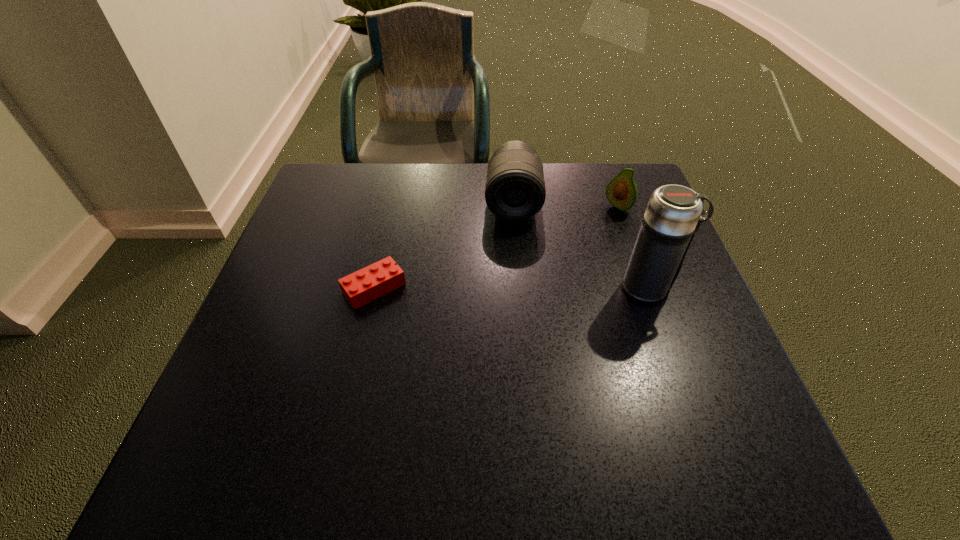
Locate an element on the screen. Image resolution: width=960 pixels, height=540 pixels. vacant space on the desktop that is between the shortest object and the tallest object and is positioned on the surface of the telephoto lens is located at coordinates (513, 288).

You are a GUI agent. You are given a task and a screenshot of the screen. Output one action in this format:
    pyautogui.click(x=<x>, y=<y>)
    Task: Click on the vacant spot on the desktop that is between the shortest object and the thermos bottle and is positioned on the cut side of the second shortest object
    Image resolution: width=960 pixels, height=540 pixels.
    Given the screenshot: What is the action you would take?
    pyautogui.click(x=517, y=288)